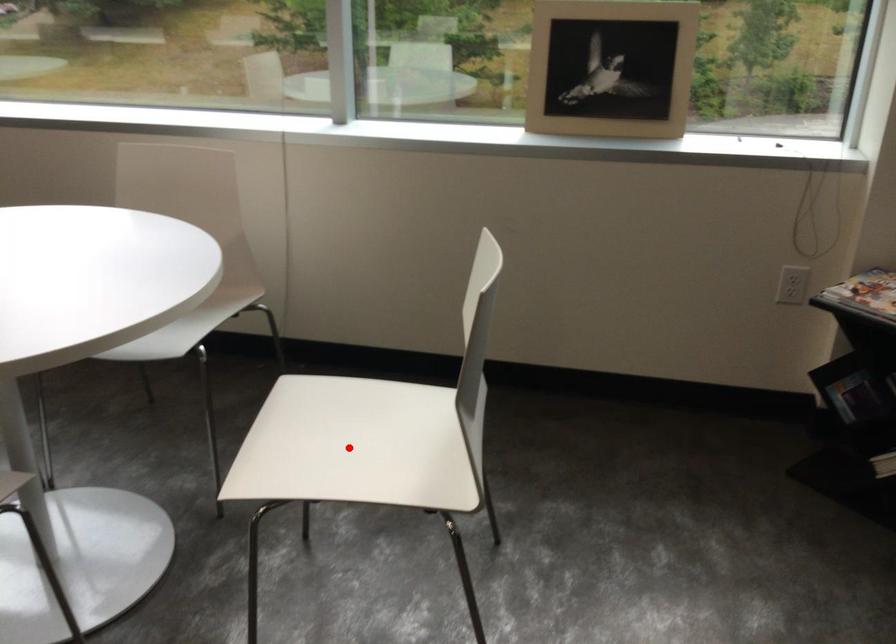
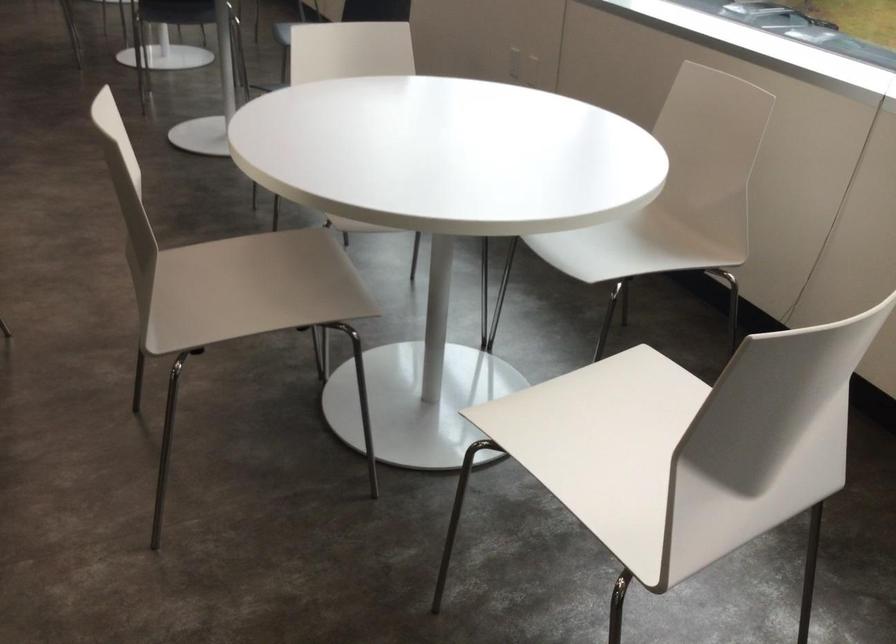
Question: I am providing you with two images of the same scene from different viewpoints. Given a red point in image1, look at the same physical point in image2. Is it:

Choices:
 (A) Closer to the viewpoint
 (B) Farther from the viewpoint

Answer: (A)